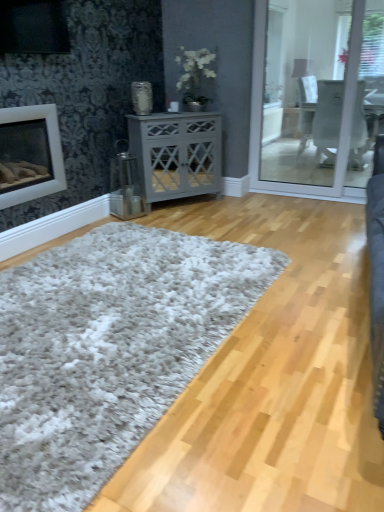
This screenshot has height=512, width=384. I want to click on vacant area on top of white shaggy rug at center (from a real-world perspective), so click(104, 302).